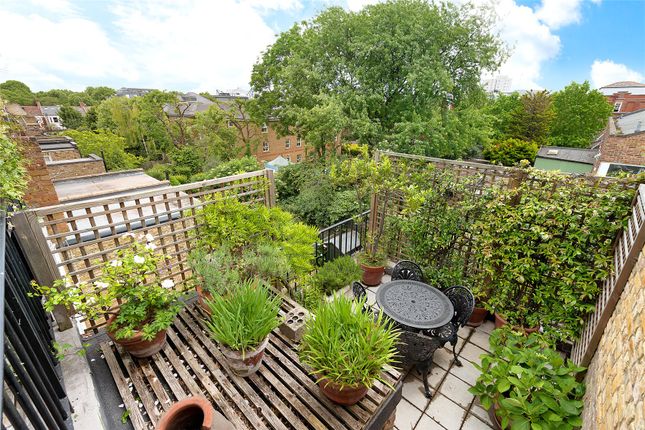
Locate an element on the screen. wood railing is located at coordinates (163, 195), (481, 181).